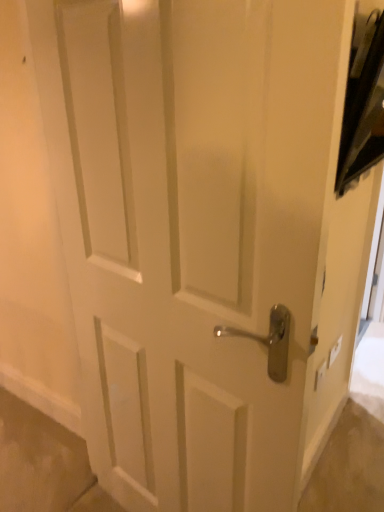
Question: Is white plastic light switch at upper right, positioned as the 1th light switch in right-to-left order, at the left side of white plastic light switch at lower right, which is counted as the first light switch, starting from the left?

Choices:
 (A) yes
 (B) no

Answer: (B)

Question: Is white plastic light switch at upper right, the 2th light switch in the front-to-back sequence, to the right of white plastic light switch at lower right, which is counted as the first light switch, starting from the left, from the viewer's perspective?

Choices:
 (A) no
 (B) yes

Answer: (B)

Question: Can you confirm if white plastic light switch at upper right, the first light switch viewed from the back, is taller than white plastic light switch at lower right, the first light switch when ordered from front to back?

Choices:
 (A) yes
 (B) no

Answer: (B)

Question: Does white plastic light switch at upper right, the 2th light switch in the front-to-back sequence, have a lesser height compared to white plastic light switch at lower right, which is counted as the first light switch, starting from the left?

Choices:
 (A) yes
 (B) no

Answer: (A)

Question: From a real-world perspective, is white plastic light switch at upper right, the 2th light switch in the front-to-back sequence, positioned under white plastic light switch at lower right, the first light switch when ordered from front to back, based on gravity?

Choices:
 (A) no
 (B) yes

Answer: (B)

Question: Can you confirm if white plastic light switch at upper right, the 2th light switch in the front-to-back sequence, is thinner than white plastic light switch at lower right, which is counted as the first light switch, starting from the left?

Choices:
 (A) no
 (B) yes

Answer: (A)

Question: Does white plastic light switch at lower right, which is counted as the first light switch, starting from the left, turn towards white plastic light switch at upper right, the first light switch viewed from the back?

Choices:
 (A) yes
 (B) no

Answer: (B)

Question: Does white plastic light switch at lower right, which is counted as the first light switch, starting from the left, have a lesser width compared to white plastic light switch at upper right, positioned as the 1th light switch in right-to-left order?

Choices:
 (A) no
 (B) yes

Answer: (A)

Question: From the image's perspective, does white plastic light switch at lower right, the first light switch when ordered from front to back, appear lower than white plastic light switch at upper right, the first light switch viewed from the back?

Choices:
 (A) no
 (B) yes

Answer: (B)

Question: Considering the relative sizes of white plastic light switch at lower right, which is counted as the first light switch, starting from the left, and white plastic light switch at upper right, the first light switch viewed from the back, in the image provided, is white plastic light switch at lower right, which is counted as the first light switch, starting from the left, shorter than white plastic light switch at upper right, the first light switch viewed from the back,?

Choices:
 (A) no
 (B) yes

Answer: (A)

Question: From the image's perspective, is white plastic light switch at lower right, which is counted as the first light switch, starting from the left, over white plastic light switch at upper right, the 2th light switch in the front-to-back sequence?

Choices:
 (A) no
 (B) yes

Answer: (A)

Question: Can you confirm if white plastic light switch at lower right, which is counted as the first light switch, starting from the left, is positioned to the right of white plastic light switch at upper right, the first light switch viewed from the back?

Choices:
 (A) yes
 (B) no

Answer: (B)

Question: From a real-world perspective, relative to white plastic light switch at lower right, the first light switch when ordered from front to back, is white plastic light switch at upper right, the first light switch viewed from the back, vertically above or below?

Choices:
 (A) below
 (B) above

Answer: (A)